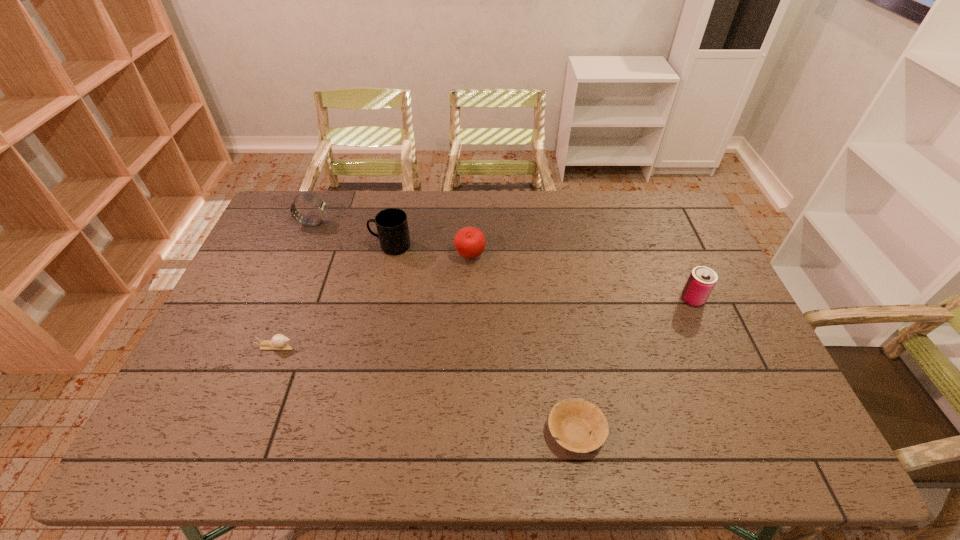
Where is `free spot located on the side of the fourth object from right to left with the handle`? This screenshot has width=960, height=540. free spot located on the side of the fourth object from right to left with the handle is located at coordinates (276, 246).

This screenshot has width=960, height=540. I want to click on vacant space located 0.140m on the face of the farthest object, so click(369, 223).

Locate an element on the screen. This screenshot has width=960, height=540. vacant space situated 0.070m on the back of the apple is located at coordinates (470, 233).

Where is `vacant space located on the back of the can`? vacant space located on the back of the can is located at coordinates 665,237.

Find the location of a particular element. free space located on the shell of the escargot is located at coordinates (411, 346).

Where is `vacant space located 0.250m on the left of the bowl`? Image resolution: width=960 pixels, height=540 pixels. vacant space located 0.250m on the left of the bowl is located at coordinates (441, 432).

This screenshot has height=540, width=960. Identify the location of object situated at the far edge. (321, 205).

Where is `object at the near edge`? Image resolution: width=960 pixels, height=540 pixels. object at the near edge is located at coordinates (577, 425).

Where is `watch at the left edge`? This screenshot has width=960, height=540. watch at the left edge is located at coordinates (321, 205).

Where is `escargot situated at the left edge`? The image size is (960, 540). escargot situated at the left edge is located at coordinates (279, 342).